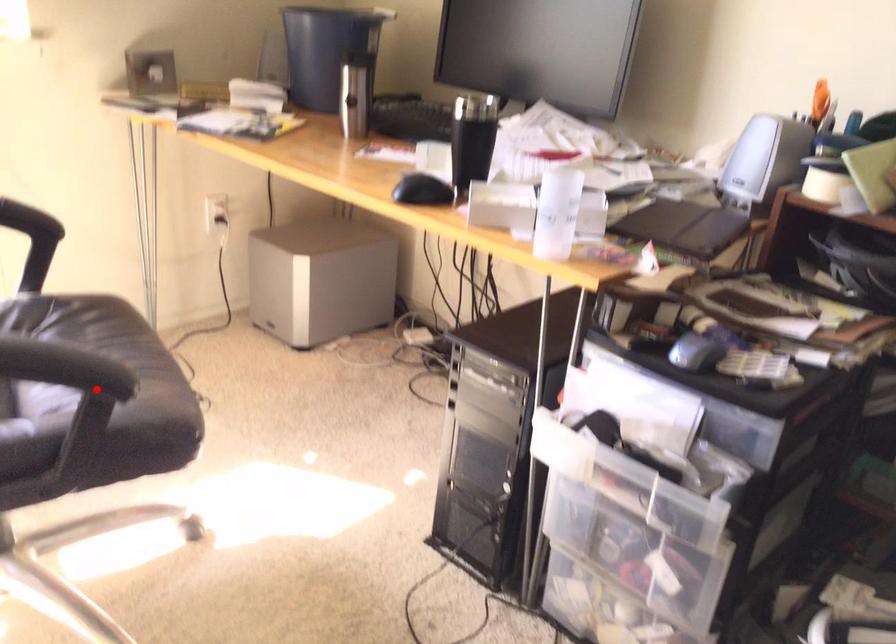
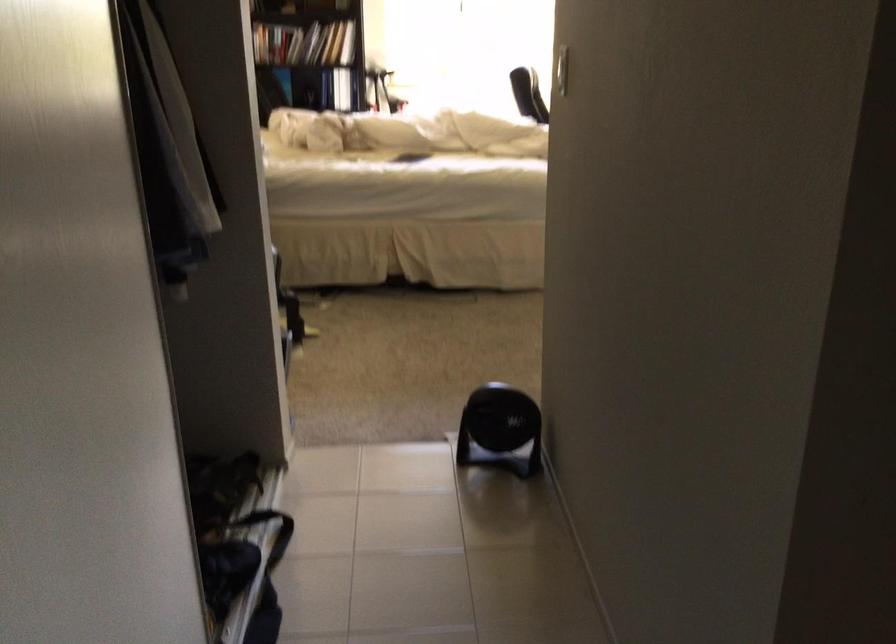
Question: I am providing you with two images of the same scene from different viewpoints. A red point is marked on the first image. At the location where the point appears in image 1, is it still visible in image 2?

Choices:
 (A) Yes
 (B) No

Answer: (B)